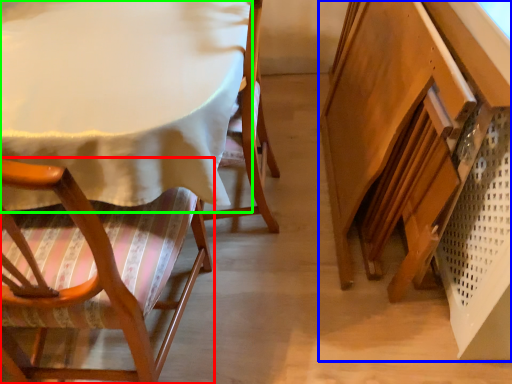
Question: Considering the real-world distances, which object is closest to chair (highlighted by a red box)? vanity (highlighted by a blue box) or table (highlighted by a green box).

Choices:
 (A) vanity
 (B) table

Answer: (B)